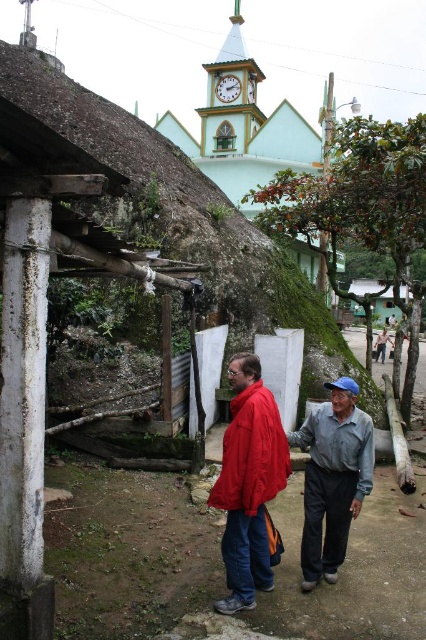
You are a photographer planning to take a portrait of the two people in front of the green leafy tree at center and the white painted wood clock tower at upper center. Which object should you position closer to the subjects to ensure the clock tower is visible in the background?

You should position the white painted wood clock tower at upper center closer to the subjects because it is taller than the green leafy tree at center, allowing it to stand out in the background.

You are standing at the base of the slope on the left side of the image. You want to walk straight towards the green leafy tree at center. Will you have to climb uphill or downhill?

The green leafy tree at center is located at point (363,216). Since the slope is on the left side, moving towards the center would mean walking towards higher ground, so you would have to climb uphill.